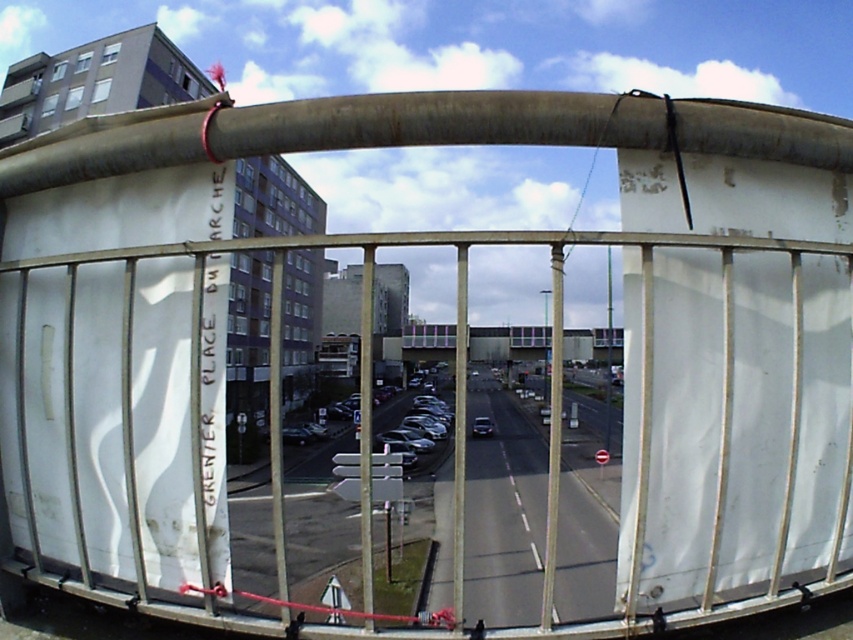
You are a pedestrian standing on the concrete bridge at center. You want to cross the street to reach a store located where the shiny black car at center is parked. Is there a safe path to walk directly to the car without going under the bridge?

The concrete bridge at center is above the shiny black car at center, so you cannot walk directly to the car without going under the bridge. You will need to find another route that goes around the bridge or under it to reach the car.

You are standing on the metal railing looking down at the scene. There is a concrete bridge at center and a shiny black car at center. Which object is located to the right of the other?

The concrete bridge at center is positioned on the right side of the shiny black car at center, so the concrete bridge at center is to the right of the shiny black car at center.

You are standing at the metal railing overlooking the city street. You need to cross to the other side of the bridge. Based on your position at the railing, is the concrete bridge at center to your left or right?

The concrete bridge at center is located at point coordinates which place it directly in front of you, so it is neither to your left nor right but straight ahead.